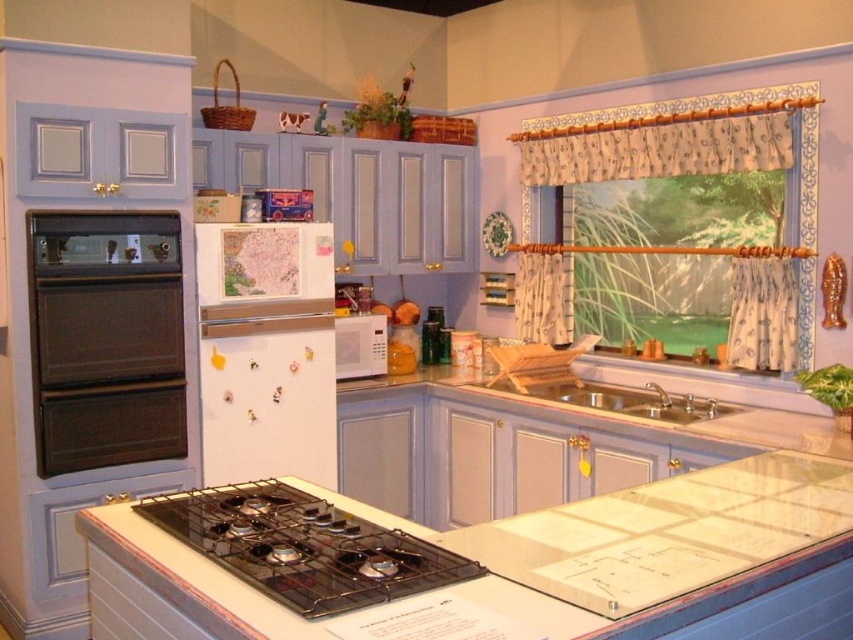
Which is more to the right, white glossy countertop at center or black matte gas stove at center?

From the viewer's perspective, white glossy countertop at center appears more on the right side.

Where is `white glossy countertop at center`? The image size is (853, 640). white glossy countertop at center is located at coordinates (630, 536).

Where is `white glossy countertop at center`? Image resolution: width=853 pixels, height=640 pixels. white glossy countertop at center is located at coordinates (630, 536).

Is point (332, 355) positioned after point (231, 486)?

Yes.

Which is more to the right, white matte refrigerator at center or black matte gas stove at center?

black matte gas stove at center is more to the right.

This screenshot has width=853, height=640. I want to click on white matte refrigerator at center, so click(265, 352).

At what (x,y) coordinates should I click in order to perform the action: click on white matte refrigerator at center. Please return your answer as a coordinate pair (x, y). Looking at the image, I should click on (265, 352).

Does white glossy countertop at center have a larger size compared to matte black oven at left?

Indeed, white glossy countertop at center has a larger size compared to matte black oven at left.

Does white glossy countertop at center appear under matte black oven at left?

Yes, white glossy countertop at center is below matte black oven at left.

Does point (817, 472) lie in front of point (100, 332)?

Yes, point (817, 472) is closer to viewer.

Locate an element on the screen. The height and width of the screenshot is (640, 853). white glossy countertop at center is located at coordinates (630, 536).